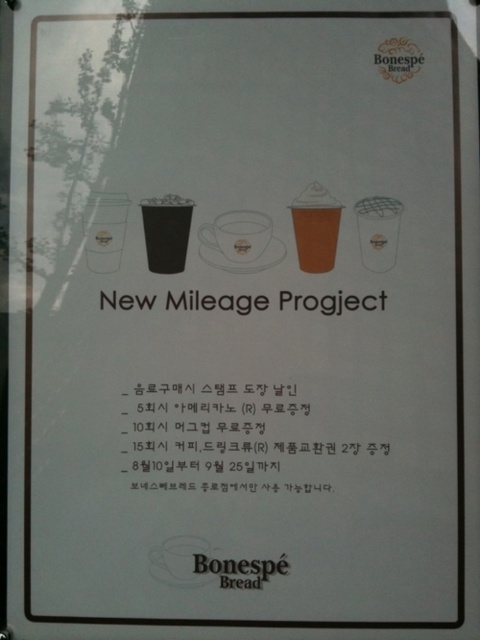
Question: Among these objects, which one is farthest from the camera?

Choices:
 (A) white matte cup at center
 (B) black paper text at center

Answer: (A)

Question: Is black paper at center wider than black matte cup at center?

Choices:
 (A) no
 (B) yes

Answer: (B)

Question: Is brown paper cup at center above black matte cup at center?

Choices:
 (A) yes
 (B) no

Answer: (A)

Question: Can you confirm if brown paper cup at center is thinner than black matte cup at center?

Choices:
 (A) yes
 (B) no

Answer: (A)

Question: Which point is closer to the camera taking this photo?

Choices:
 (A) (175, 240)
 (B) (256, 224)

Answer: (B)

Question: Which of the following is the closest to the observer?

Choices:
 (A) (187, 220)
 (B) (210, 227)
 (C) (385, 294)
 (D) (220, 573)

Answer: (D)